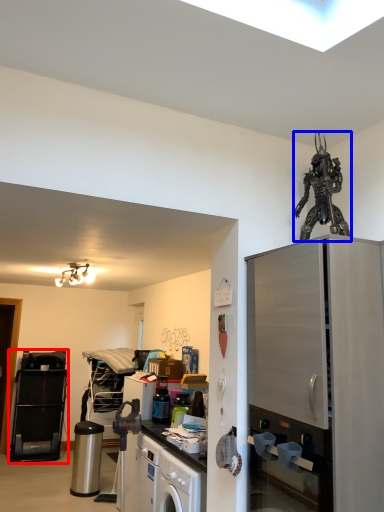
Question: Among these objects, which one is nearest to the camera, appliance (highlighted by a red box) or toy (highlighted by a blue box)?

Choices:
 (A) appliance
 (B) toy

Answer: (B)